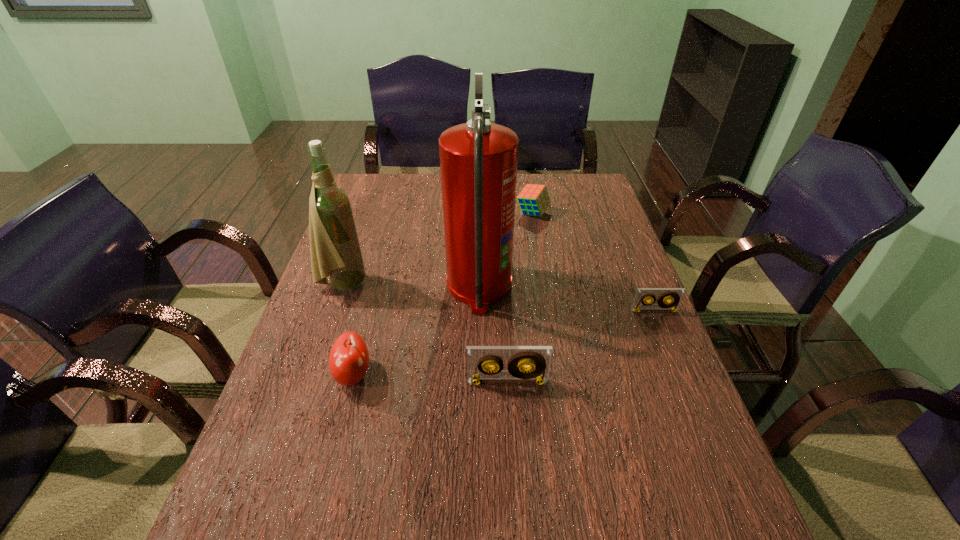
The width and height of the screenshot is (960, 540). In order to click on free point that keeps the videotapes evenly spaced on the left in this screenshot , I will do [x=300, y=482].